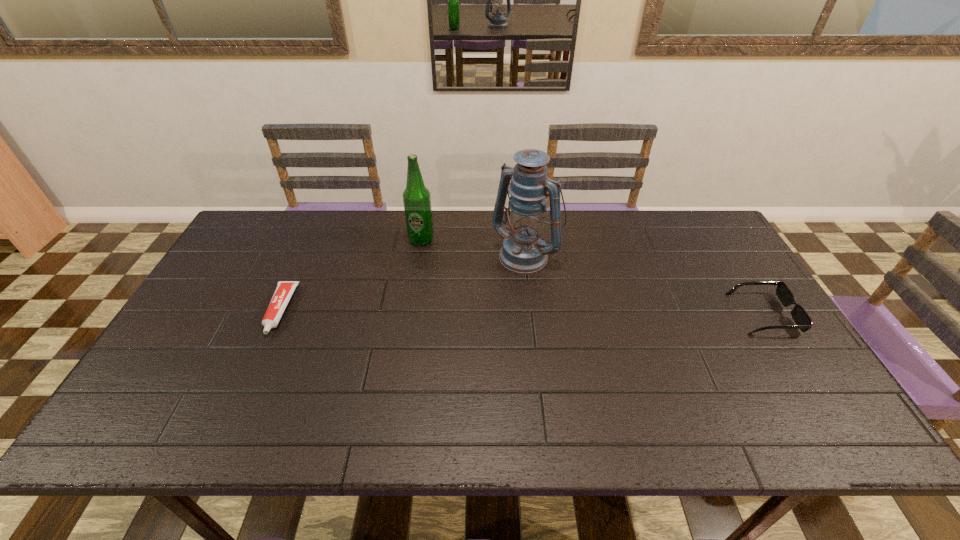
The height and width of the screenshot is (540, 960). In order to click on vacant point located on the front-facing side of the lantern in this screenshot , I will do `click(500, 280)`.

Locate an element on the screen. The image size is (960, 540). vacant space located 0.070m on the front-facing side of the lantern is located at coordinates (496, 284).

Locate an element on the screen. vacant space located on the label of the third shortest object is located at coordinates (432, 255).

Where is `free space located 0.360m on the label of the third shortest object`? This screenshot has height=540, width=960. free space located 0.360m on the label of the third shortest object is located at coordinates (478, 320).

The width and height of the screenshot is (960, 540). What are the coordinates of `vacant space located on the label of the third shortest object` in the screenshot? It's located at point(468,306).

Where is `lantern that is at the far edge`? lantern that is at the far edge is located at coordinates (524, 250).

Where is `beer bottle that is at the far edge`? The height and width of the screenshot is (540, 960). beer bottle that is at the far edge is located at coordinates (416, 197).

At what (x,y) coordinates should I click in order to perform the action: click on object that is at the right edge. Please return your answer as a coordinate pair (x, y). Looking at the image, I should click on (803, 321).

Locate an element on the screen. free location at the far edge is located at coordinates (617, 216).

Locate an element on the screen. This screenshot has width=960, height=540. free region at the near edge of the desktop is located at coordinates (227, 392).